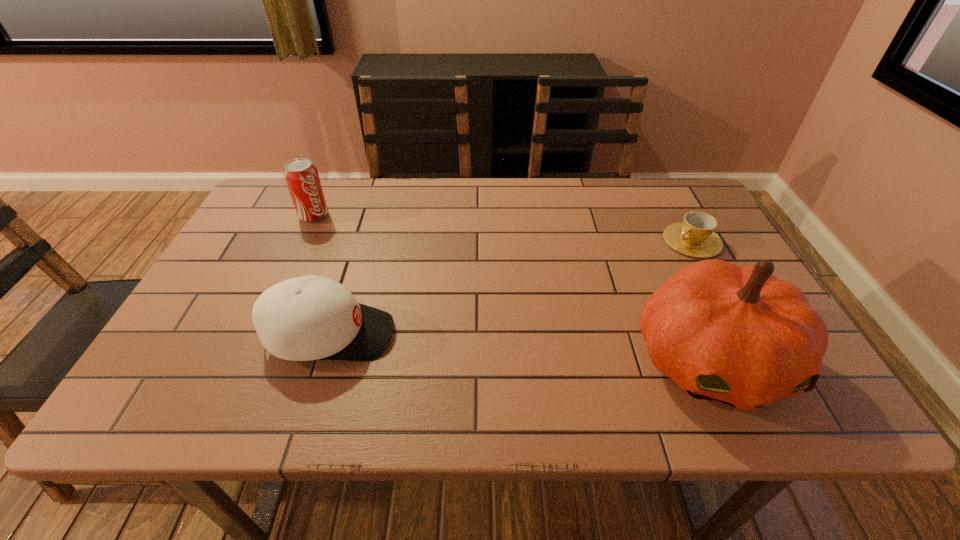
Identify the location of baseball cap. The height and width of the screenshot is (540, 960). (306, 318).

Where is `the tallest object`? the tallest object is located at coordinates (735, 334).

At what (x,y) coordinates should I click in order to perform the action: click on soda can. Please return your answer as a coordinate pair (x, y). The width and height of the screenshot is (960, 540). Looking at the image, I should click on (301, 176).

Identify the location of cup. Image resolution: width=960 pixels, height=540 pixels. (695, 236).

Where is `free point located on the front-facing side of the second shortest object`? This screenshot has height=540, width=960. free point located on the front-facing side of the second shortest object is located at coordinates (527, 335).

What are the coordinates of `free region located on the logo side of the soda can` in the screenshot? It's located at (372, 264).

At what (x,y) coordinates should I click in order to perform the action: click on free location located 0.160m on the logo side of the soda can. Please return your answer as a coordinate pair (x, y). The height and width of the screenshot is (540, 960). Looking at the image, I should click on (352, 248).

What are the coordinates of `vacant space located 0.300m on the logo side of the soda can` in the screenshot? It's located at (382, 274).

Image resolution: width=960 pixels, height=540 pixels. In order to click on free location located with the handle on the side of the shortest object in this screenshot , I will do `click(557, 313)`.

Locate an element on the screen. The height and width of the screenshot is (540, 960). vacant space located 0.080m with the handle on the side of the shortest object is located at coordinates (653, 262).